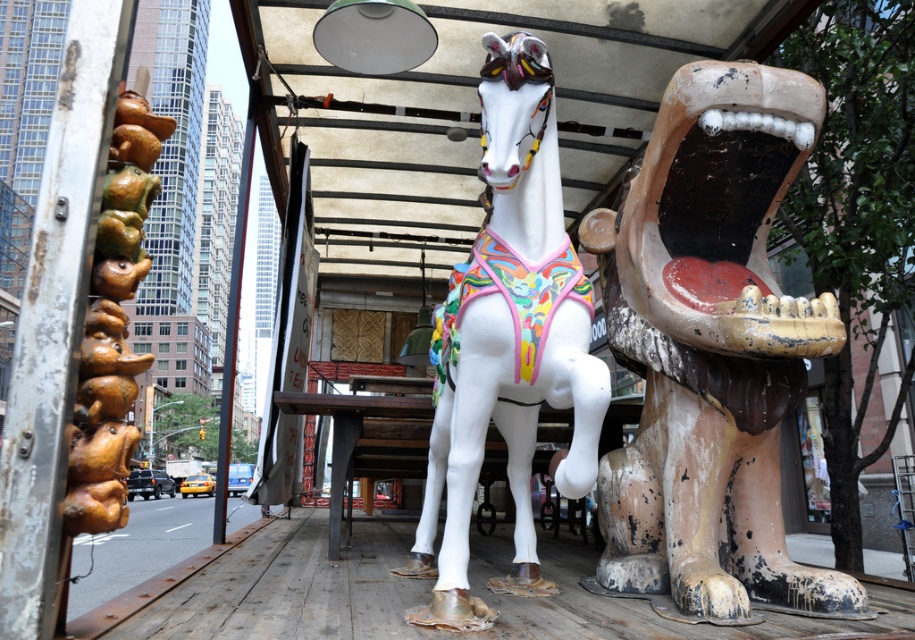
Looking at this image, you are an art curator planning to move the white glossy horse at center and the brown glazed ceramic dog at left into a new gallery. The gallery has a height restriction of 2 meters. Can both sculptures fit under this height limit?

The white glossy horse at center is taller than the brown glazed ceramic dog at left. However, since the height restriction is 2 meters, we need to know the exact heights of both sculptures to determine if they fit. The information provided does not include their specific measurements, so it is unclear if both will fit under the 2 meter limit.

You are an art curator planning to photograph the painted wood lion at right. Based on its coordinates, where should you position your camera to ensure it is centered in the frame?

The painted wood lion at right is located at coordinates point (711, 349), so positioning the camera to center on those coordinates would ensure it is centered in the frame.